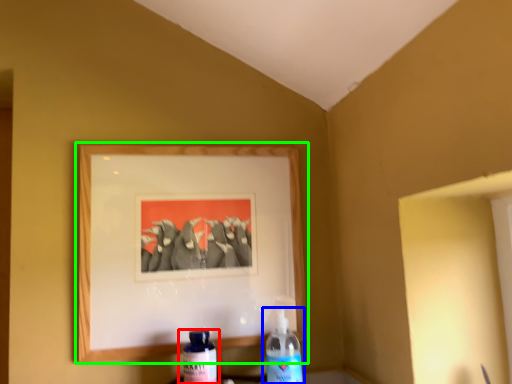
Question: Considering the real-world distances, which object is farthest from bottle (highlighted by a red box)? bottle (highlighted by a blue box) or picture frame (highlighted by a green box)?

Choices:
 (A) bottle
 (B) picture frame

Answer: (B)